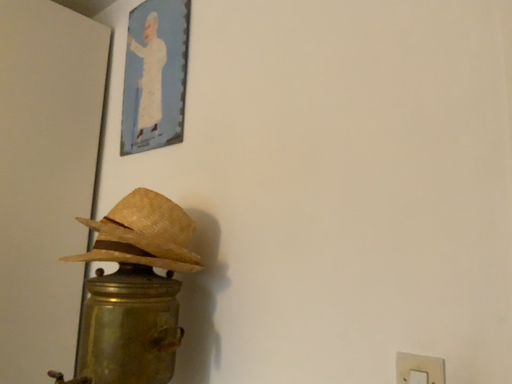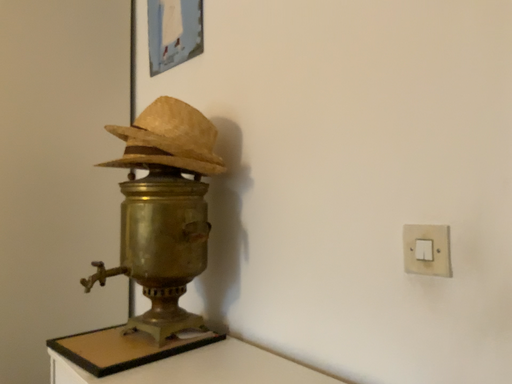
Question: Which way did the camera rotate in the video?

Choices:
 (A) rotated downward
 (B) rotated upward

Answer: (A)